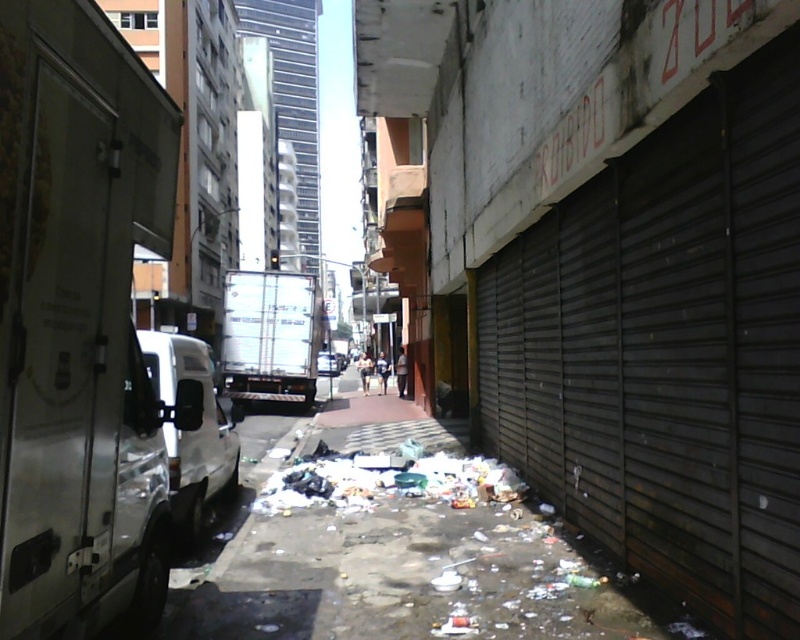
You are a delivery person trying to navigate through the alley. There are two vans blocking your path. You see the white metallic van at left and the white matte van at center. Which van is closer to you?

The white metallic van at left is closer to you because it is positioned over the white matte van at center, meaning it is in front of it.

You are standing at point A located at coordinates point A at (61,376). You want to walk to point B, which is 2.00 meters away from point A. Is there enough space to walk directly from point A to point B without stepping on any debris?

The points are 2.00 meters apart, so there is enough space to walk directly from point A to point B without stepping on debris.